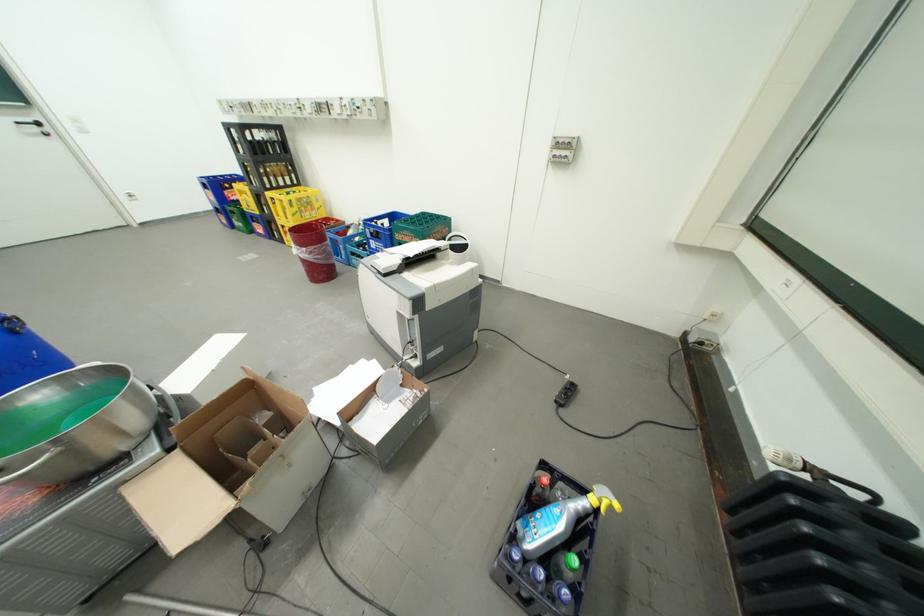
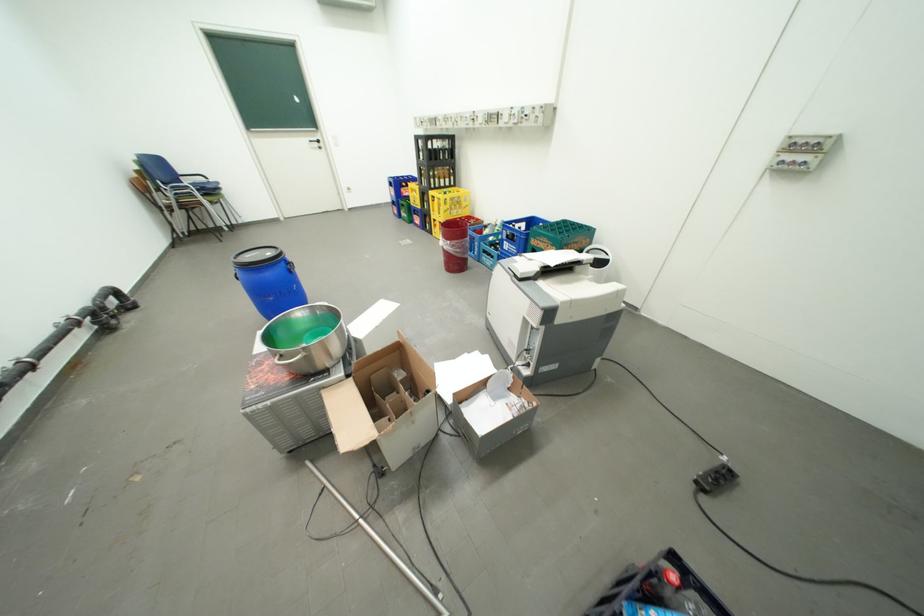
Where in the second image is the point corresponding to pixel 314 249 from the first image?

(459, 243)